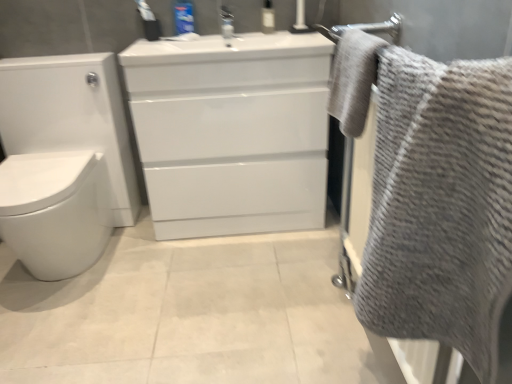
Question: Is gray textured towel at upper right, which is the 2th bath towel from bottom to top, oriented away from blue plastic toothpaste tube at upper center, placed as the second toiletry when sorted from right to left?

Choices:
 (A) no
 (B) yes

Answer: (A)

Question: Is the position of gray textured towel at upper right, acting as the first bath towel starting from the top, more distant than that of blue plastic toothpaste tube at upper center, which is counted as the 1th toiletry, starting from the left?

Choices:
 (A) no
 (B) yes

Answer: (A)

Question: Does gray textured towel at upper right, which is the 2th bath towel from bottom to top, have a greater height compared to blue plastic toothpaste tube at upper center, which is counted as the 1th toiletry, starting from the left?

Choices:
 (A) no
 (B) yes

Answer: (B)

Question: From a real-world perspective, is gray textured towel at upper right, which is the 2th bath towel from bottom to top, over blue plastic toothpaste tube at upper center, placed as the second toiletry when sorted from right to left?

Choices:
 (A) yes
 (B) no

Answer: (B)

Question: Does gray textured towel at upper right, which is the 2th bath towel from bottom to top, turn towards blue plastic toothpaste tube at upper center, which is counted as the 1th toiletry, starting from the left?

Choices:
 (A) no
 (B) yes

Answer: (A)

Question: From the image's perspective, is gray textured towel at right, the 2th bath towel positioned from the top, located above or below blue plastic toothpaste tube at upper center, placed as the second toiletry when sorted from right to left?

Choices:
 (A) above
 (B) below

Answer: (B)

Question: Is gray textured towel at right, the 1th bath towel ordered from the bottom, situated inside blue plastic toothpaste tube at upper center, placed as the second toiletry when sorted from right to left, or outside?

Choices:
 (A) outside
 (B) inside

Answer: (A)

Question: Relative to blue plastic toothpaste tube at upper center, placed as the second toiletry when sorted from right to left, is gray textured towel at right, the 2th bath towel positioned from the top, in front or behind?

Choices:
 (A) behind
 (B) front

Answer: (B)

Question: Is gray textured towel at right, the 1th bath towel ordered from the bottom, to the left or to the right of blue plastic toothpaste tube at upper center, placed as the second toiletry when sorted from right to left, in the image?

Choices:
 (A) right
 (B) left

Answer: (A)

Question: Considering the positions of point (483, 296) and point (272, 26), is point (483, 296) closer or farther from the camera than point (272, 26)?

Choices:
 (A) closer
 (B) farther

Answer: (A)

Question: Considering the positions of gray textured towel at right, the 2th bath towel positioned from the top, and transparent plastic bottle at upper center, the second toiletry positioned from the left, in the image, is gray textured towel at right, the 2th bath towel positioned from the top, bigger or smaller than transparent plastic bottle at upper center, the second toiletry positioned from the left,?

Choices:
 (A) big
 (B) small

Answer: (A)

Question: Considering the positions of gray textured towel at right, the 1th bath towel ordered from the bottom, and transparent plastic bottle at upper center, which ranks as the first toiletry in right-to-left order, in the image, is gray textured towel at right, the 1th bath towel ordered from the bottom, wider or thinner than transparent plastic bottle at upper center, which ranks as the first toiletry in right-to-left order,?

Choices:
 (A) thin
 (B) wide

Answer: (B)

Question: In the image, is gray textured towel at right, the 1th bath towel ordered from the bottom, on the left side or the right side of transparent plastic bottle at upper center, which ranks as the first toiletry in right-to-left order?

Choices:
 (A) right
 (B) left

Answer: (A)

Question: From the image's perspective, is transparent plastic bottle at upper center, the second toiletry positioned from the left, positioned above or below gray textured towel at upper right, acting as the first bath towel starting from the top?

Choices:
 (A) below
 (B) above

Answer: (B)

Question: Would you say transparent plastic bottle at upper center, the second toiletry positioned from the left, is to the left or to the right of gray textured towel at upper right, acting as the first bath towel starting from the top, in the picture?

Choices:
 (A) right
 (B) left

Answer: (B)